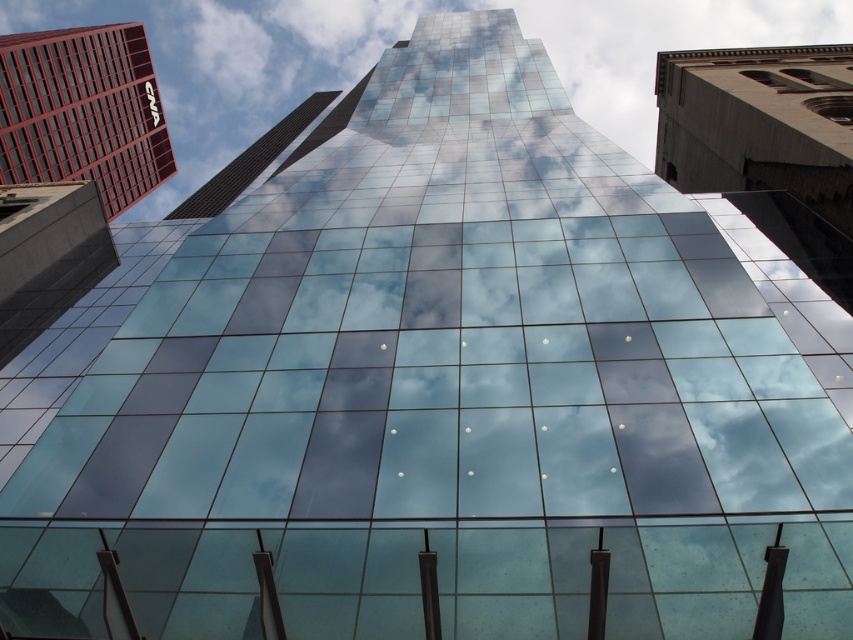
Question: Is transparent glass skyscraper at center above matte red building at upper left?

Choices:
 (A) no
 (B) yes

Answer: (B)

Question: Which object appears closest to the camera in this image?

Choices:
 (A) transparent glass skyscraper at center
 (B) matte red building at upper left

Answer: (B)

Question: Can you confirm if transparent glass skyscraper at center is positioned to the right of matte red building at upper left?

Choices:
 (A) no
 (B) yes

Answer: (B)

Question: In this image, where is transparent glass skyscraper at center located relative to matte red building at upper left?

Choices:
 (A) right
 (B) left

Answer: (A)

Question: Which object appears closest to the camera in this image?

Choices:
 (A) transparent glass skyscraper at center
 (B) matte red building at upper left

Answer: (B)